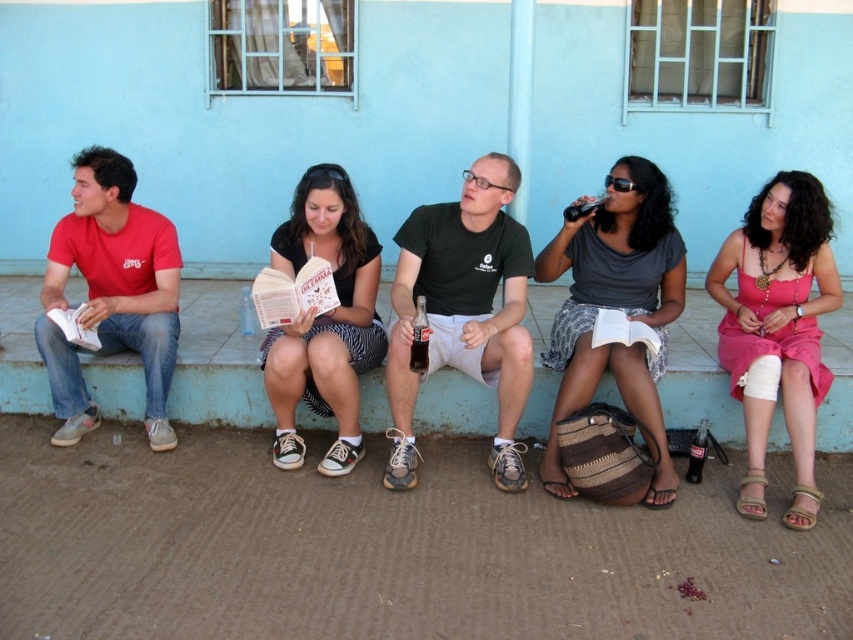
Is blue painted concrete ledge at lower center thinner than beige fabric sandal at lower right?

No, blue painted concrete ledge at lower center is not thinner than beige fabric sandal at lower right.

What do you see at coordinates (219, 396) in the screenshot?
I see `blue painted concrete ledge at lower center` at bounding box center [219, 396].

Find the location of `blue painted concrete ledge at lower center`. blue painted concrete ledge at lower center is located at coordinates (219, 396).

Can you confirm if pink satin dress at lower right is smaller than beige fabric sandal at lower right?

No.

Which is more to the right, pink satin dress at lower right or beige fabric sandal at lower right?

From the viewer's perspective, pink satin dress at lower right appears more on the right side.

At what (x,y) coordinates should I click in order to perform the action: click on pink satin dress at lower right. Please return your answer as a coordinate pair (x, y). This screenshot has height=640, width=853. Looking at the image, I should click on [776, 310].

Who is lower down, matte gray blouse at center or blue painted concrete ledge at lower center?

blue painted concrete ledge at lower center is below.

Is matte gray blouse at center closer to camera compared to blue painted concrete ledge at lower center?

Yes, it is in front of blue painted concrete ledge at lower center.

Between point (601, 353) and point (376, 424), which one is positioned in front?

Point (601, 353) is more forward.

I want to click on matte gray blouse at center, so click(x=614, y=308).